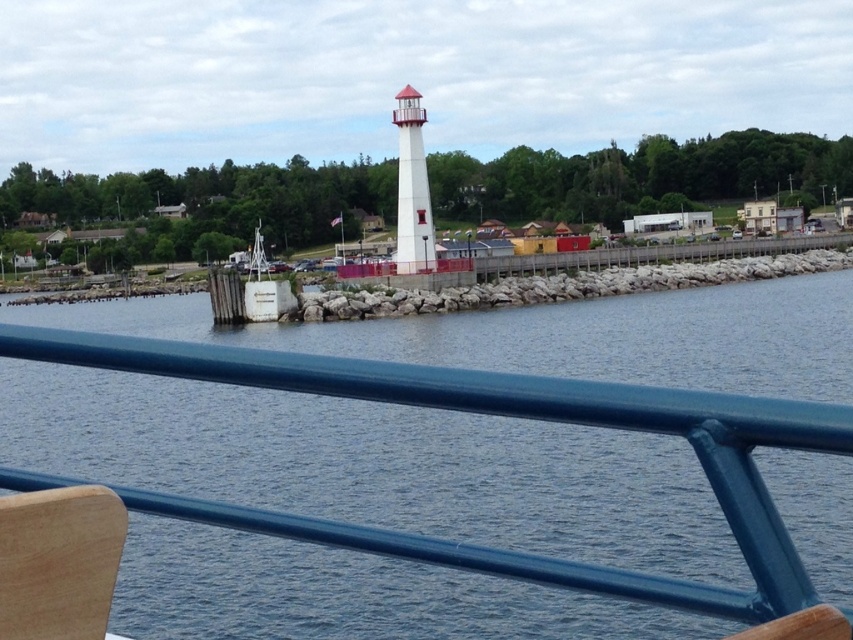
Does blue water at center have a smaller size compared to wooden chair at lower left?

No, blue water at center is not smaller than wooden chair at lower left.

Between blue water at center and wooden chair at lower left, which one has more height?

With more height is blue water at center.

Is point (155, 624) closer to camera compared to point (51, 502)?

No, it is behind (51, 502).

Locate an element on the screen. blue water at center is located at coordinates (378, 465).